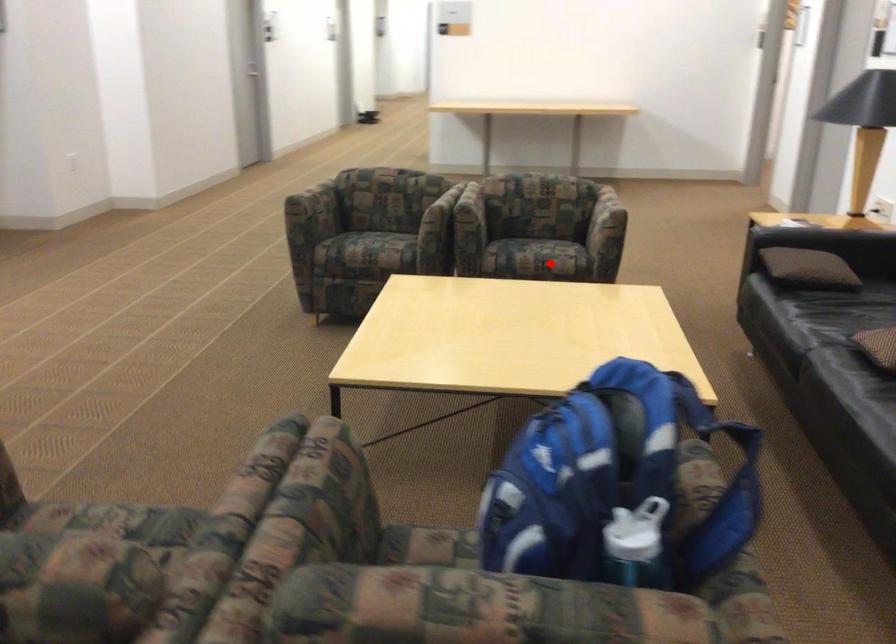
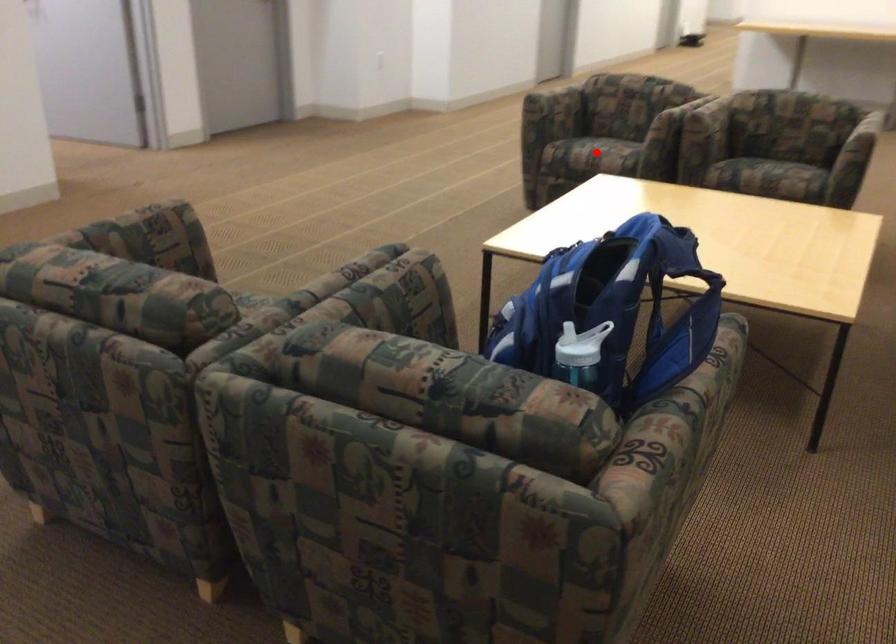
I am providing you with two images of the same scene from different viewpoints. A red point is marked on the first image and another point is marked on the second image. Is the red point in image1 aligned with the point shown in image2?

No